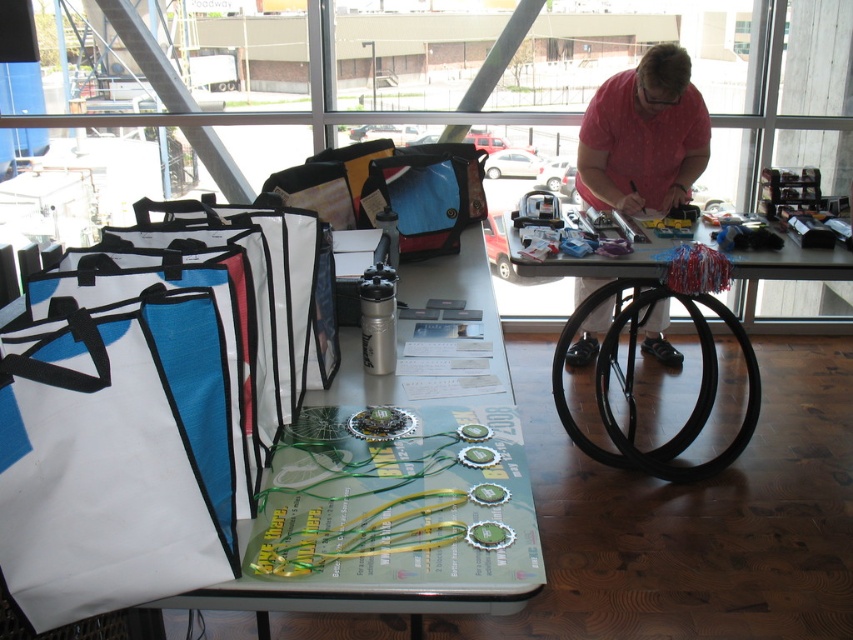
Which is below, white fabric bags at left or black rubber wheelchair at lower center?

Positioned lower is black rubber wheelchair at lower center.

Does white fabric bags at left have a lesser width compared to black rubber wheelchair at lower center?

Correct, white fabric bags at left's width is less than black rubber wheelchair at lower center's.

Measure the distance between point (386, 465) and camera.

Point (386, 465) and camera are 4.39 feet apart from each other.

At what (x,y) coordinates should I click in order to perform the action: click on white fabric bags at left. Please return your answer as a coordinate pair (x, y). The image size is (853, 640). Looking at the image, I should click on (399, 477).

Looking at this image, does black rubber wheelchair at lower center have a greater height compared to black rubber table at center?

No, black rubber wheelchair at lower center is not taller than black rubber table at center.

Find the location of a particular element. black rubber wheelchair at lower center is located at coordinates [x=631, y=387].

What do you see at coordinates (631, 387) in the screenshot? I see `black rubber wheelchair at lower center` at bounding box center [631, 387].

What are the coordinates of `black rubber wheelchair at lower center` in the screenshot? It's located at (631, 387).

Is white non-woven tote at left thinner than pink dotted shirt at upper right?

No, white non-woven tote at left is not thinner than pink dotted shirt at upper right.

Between white non-woven tote at left and pink dotted shirt at upper right, which one is positioned higher?

pink dotted shirt at upper right

Locate an element on the screen. Image resolution: width=853 pixels, height=640 pixels. white non-woven tote at left is located at coordinates (148, 404).